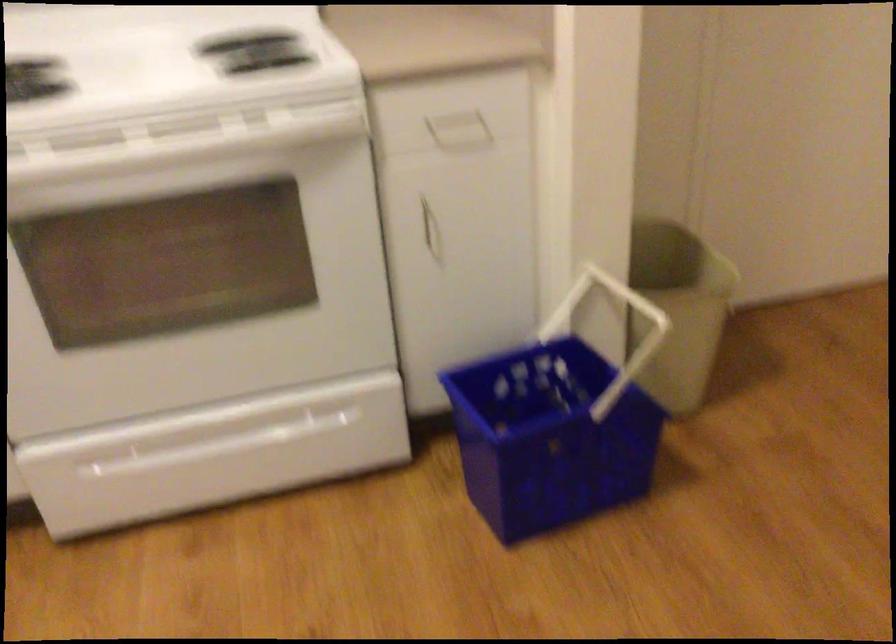
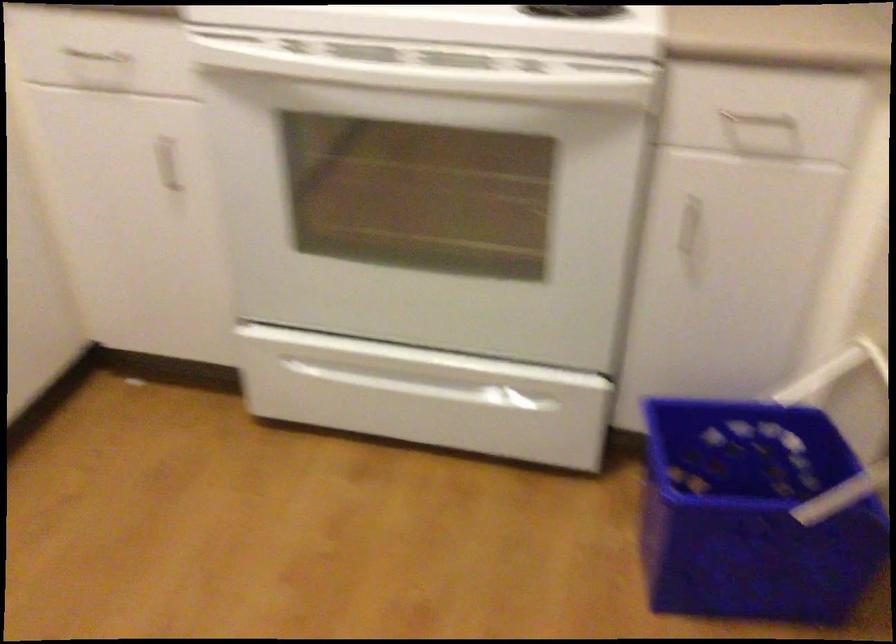
The point at (564, 431) is marked in the first image. Where is the corresponding point in the second image?

(752, 514)